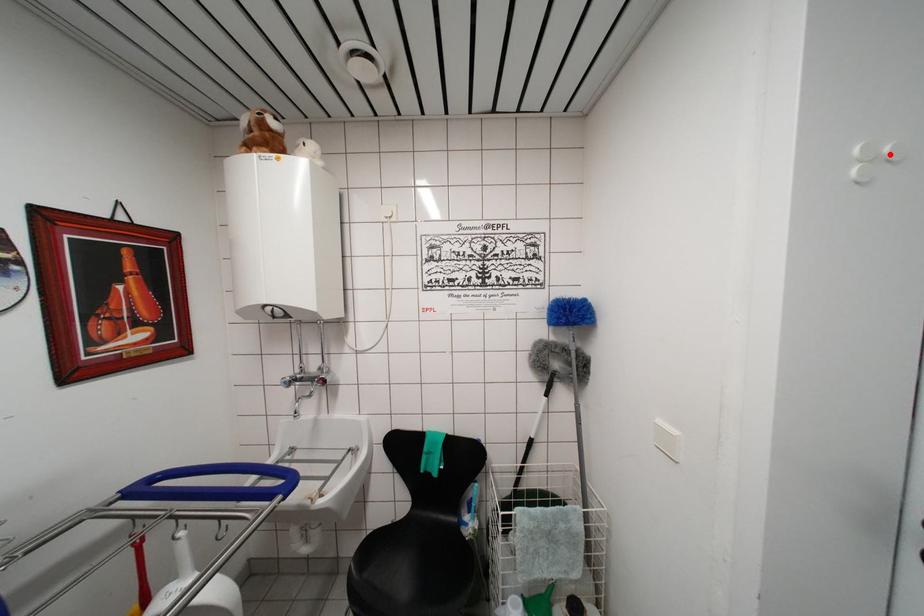
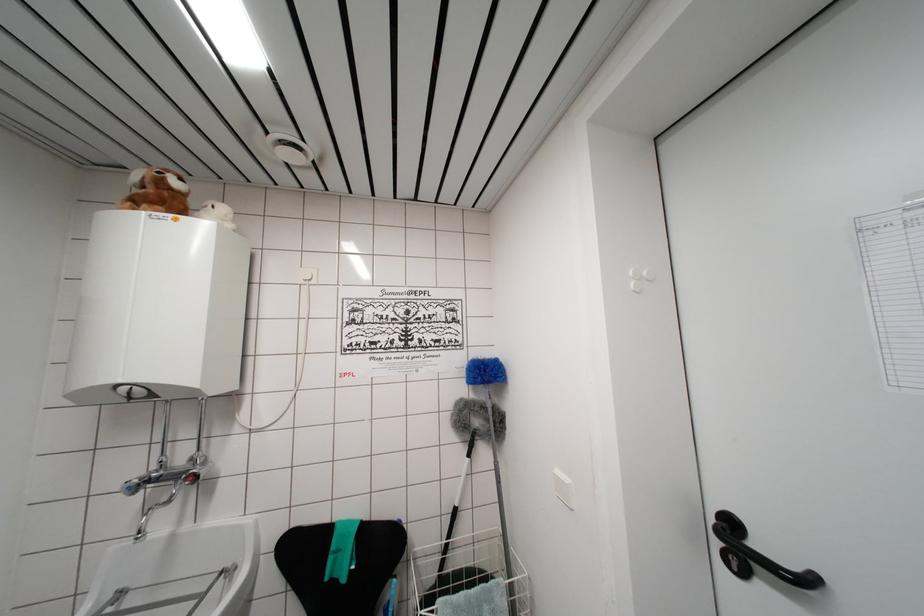
Find the pixel in the second image that matches the highlighted location in the first image.

(649, 278)